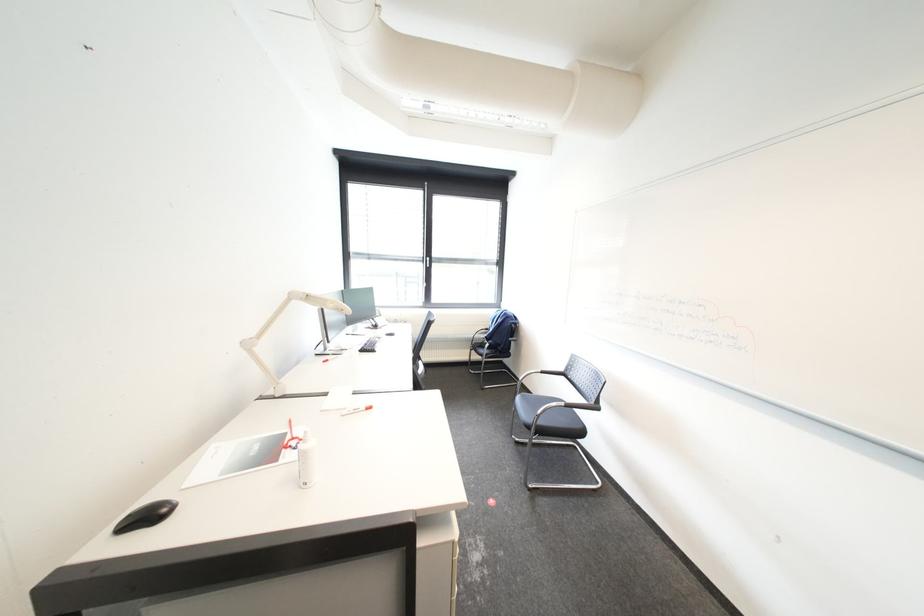
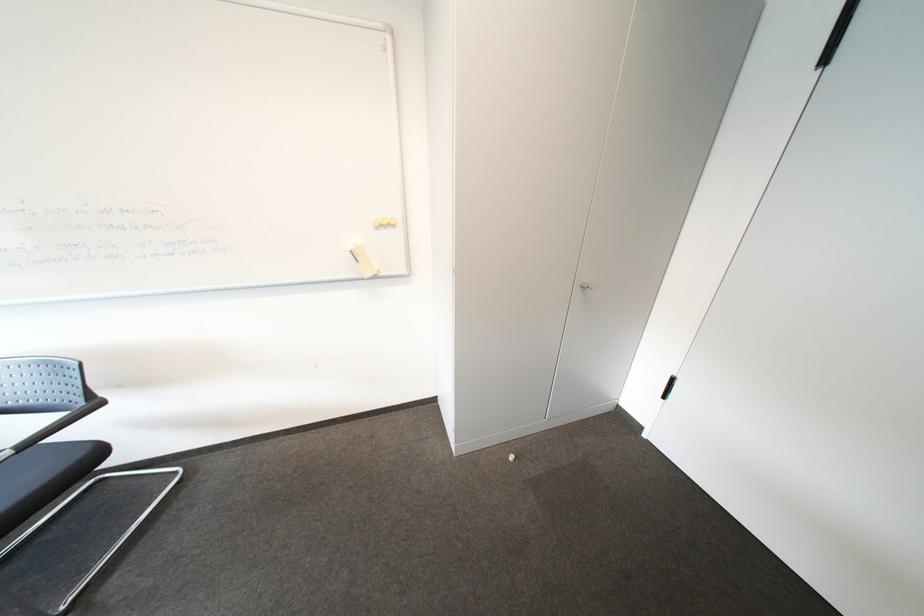
Based on the continuous images, in which direction is the camera rotating?

The camera's rotation is toward right-down.